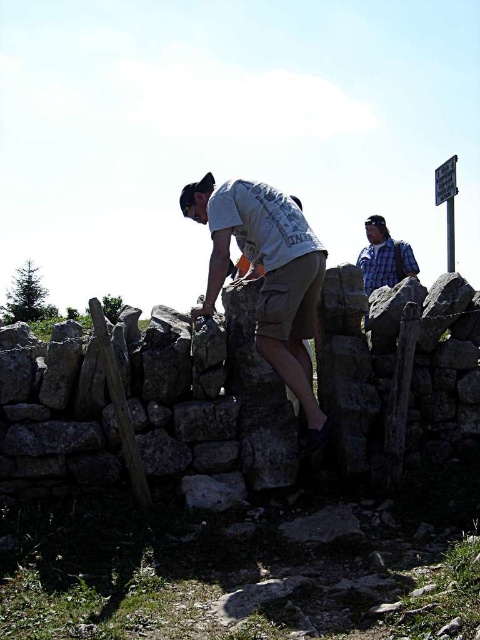
Question: Does light gray cotton shirt at center have a larger size compared to blue plaid shirt at upper right?

Choices:
 (A) no
 (B) yes

Answer: (B)

Question: Which point is farther from the camera taking this photo?

Choices:
 (A) (204, 307)
 (B) (371, 252)

Answer: (B)

Question: Among these objects, which one is farthest from the camera?

Choices:
 (A) blue plaid shirt at upper right
 (B) light gray cotton shirt at center

Answer: (A)

Question: Can you confirm if light gray cotton shirt at center is bigger than blue plaid shirt at upper right?

Choices:
 (A) no
 (B) yes

Answer: (B)

Question: Does light gray cotton shirt at center have a greater width compared to blue plaid shirt at upper right?

Choices:
 (A) no
 (B) yes

Answer: (B)